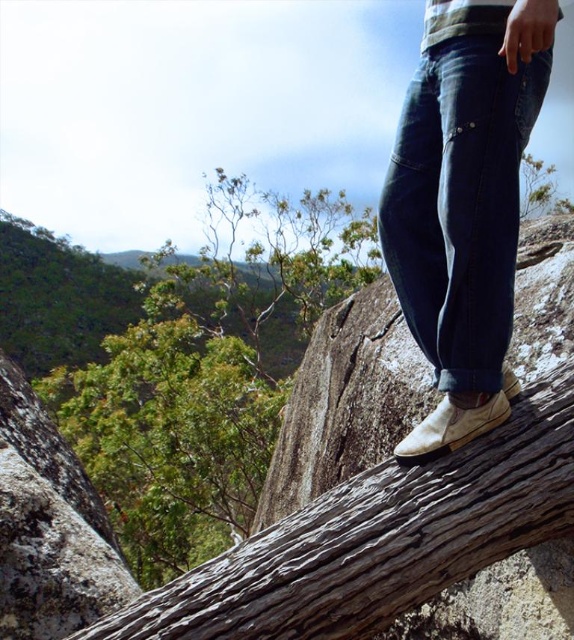
You are a hiker trying to navigate through the forest. You see a point marked at coordinates (207, 371) in the image. According to the scene, what is this point located on?

The point marked at coordinates (207, 371) is located on the green leafy tree at center.

You are planning to take a photo of the green leafy tree at center and the dark blue denim jeans at center from your current position. Considering the distance between them, will you need to adjust your camera focus to capture both clearly in the same frame?

The green leafy tree at center is 22.83 meters away from the dark blue denim jeans at center. Since the distance between them is significant, you would need to adjust your camera focus to ensure both are in clear focus. A larger depth of field might be required to capture both subjects sharply.

Based on the given coordinates of the green leafy tree at center, can you determine its position relative to the edges of the image?

The green leafy tree at center is located at the coordinates 0.581 on the x axis and 0.362 on the y axis, meaning it is positioned closer to the right edge and slightly above the bottom edge of the image.